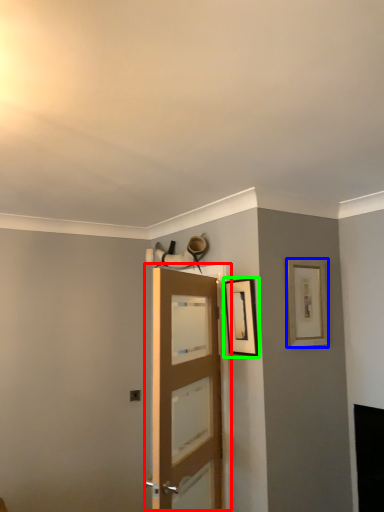
Question: Estimate the real-world distances between objects in this image. Which object is closer to door (highlighted by a red box), picture frame (highlighted by a blue box) or picture frame (highlighted by a green box)?

Choices:
 (A) picture frame
 (B) picture frame

Answer: (B)